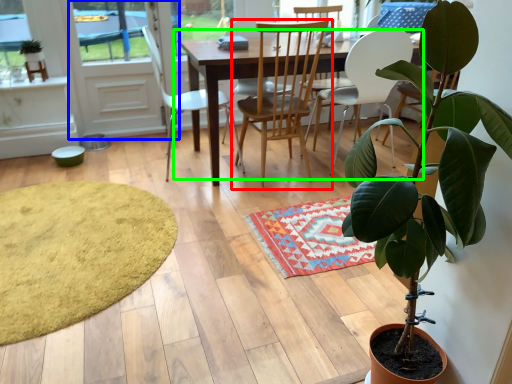
Question: Considering the real-world distances, which object is farthest from chair (highlighted by a red box)? screen door (highlighted by a blue box) or kitchen & dining room table (highlighted by a green box)?

Choices:
 (A) screen door
 (B) kitchen & dining room table

Answer: (A)